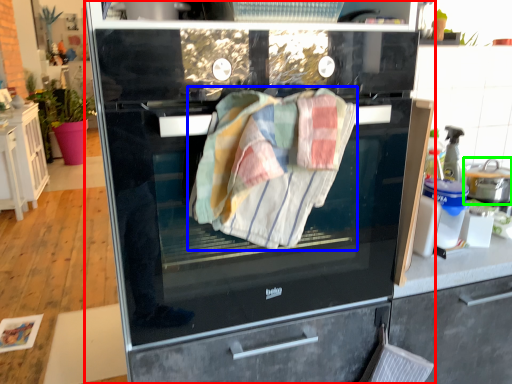
Question: Estimate the real-world distances between objects in this image. Which object is farther from home appliance (highlighted by a red box), bath towel (highlighted by a blue box) or kitchen appliance (highlighted by a green box)?

Choices:
 (A) bath towel
 (B) kitchen appliance

Answer: (B)